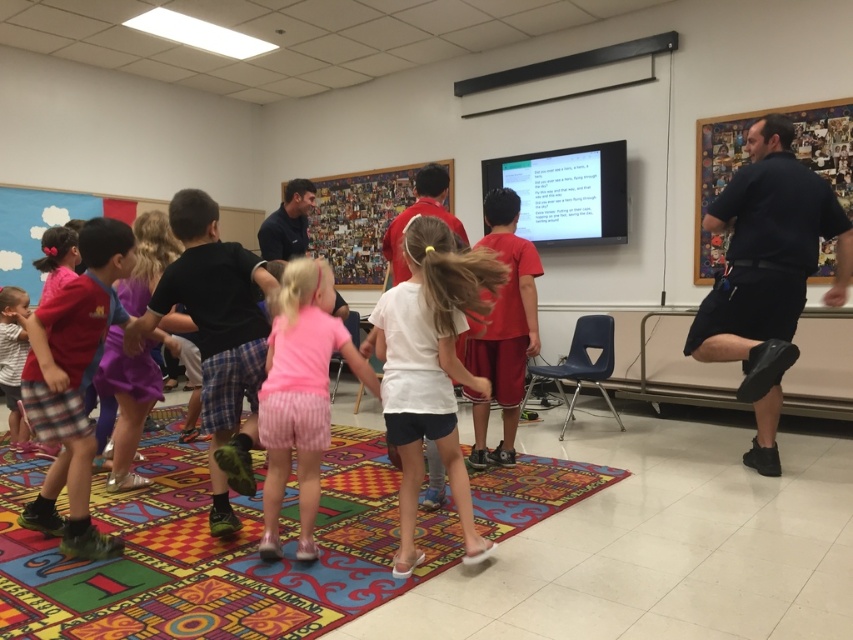
Who is positioned more to the left, pink striped shorts at center or wooden bulletin board at upper right?

Positioned to the left is pink striped shorts at center.

Which of these two, pink striped shorts at center or wooden bulletin board at upper right, stands shorter?

Standing shorter between the two is pink striped shorts at center.

At what (x,y) coordinates should I click in order to perform the action: click on pink striped shorts at center. Please return your answer as a coordinate pair (x, y). Image resolution: width=853 pixels, height=640 pixels. Looking at the image, I should click on (300, 394).

Where is `pink striped shorts at center`? The width and height of the screenshot is (853, 640). pink striped shorts at center is located at coordinates (300, 394).

Does multicolored carpet at center have a smaller size compared to wooden collage at center?

Yes.

Based on the photo, between multicolored carpet at center and wooden collage at center, which one appears on the left side from the viewer's perspective?

From the viewer's perspective, wooden collage at center appears more on the left side.

Find the location of a particular element. This screenshot has width=853, height=640. multicolored carpet at center is located at coordinates (215, 552).

I want to click on multicolored carpet at center, so click(215, 552).

Is point (846, 252) more distant than point (84, 365)?

Yes, it is.

Is dark blue shirt at upper right above matte pink shirt at center?

Correct, dark blue shirt at upper right is located above matte pink shirt at center.

Which is in front, point (786, 212) or point (74, 321)?

Point (74, 321) is more forward.

Where is `dark blue shirt at upper right`? The width and height of the screenshot is (853, 640). dark blue shirt at upper right is located at coordinates (767, 273).